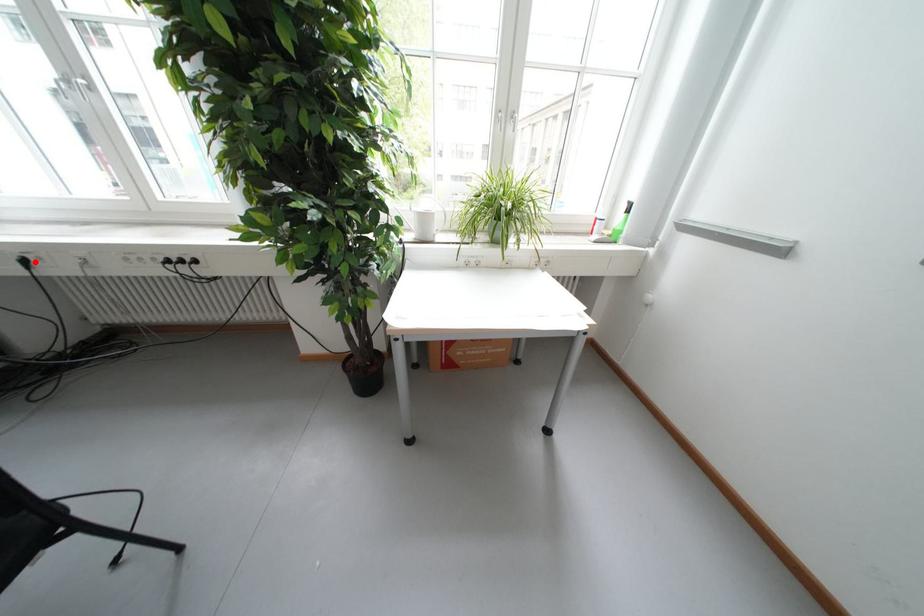
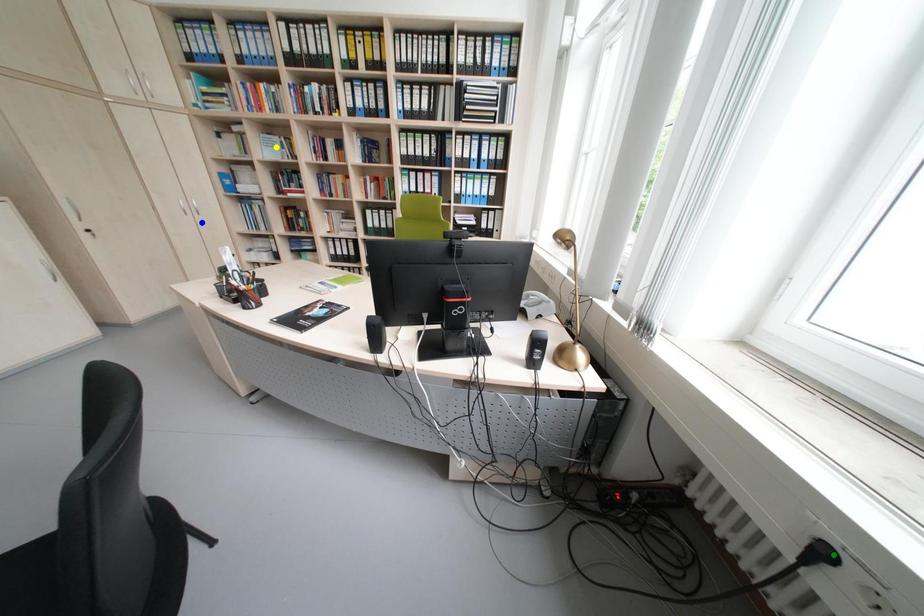
Question: I am providing you with two images of the same scene from different viewpoints. A red point is marked on the first image. You are given multiple points on the second image. Which point in image 2 is actually the same real-world point as the red point in image 1?

Choices:
 (A) blue point
 (B) green point
 (C) yellow point

Answer: (B)